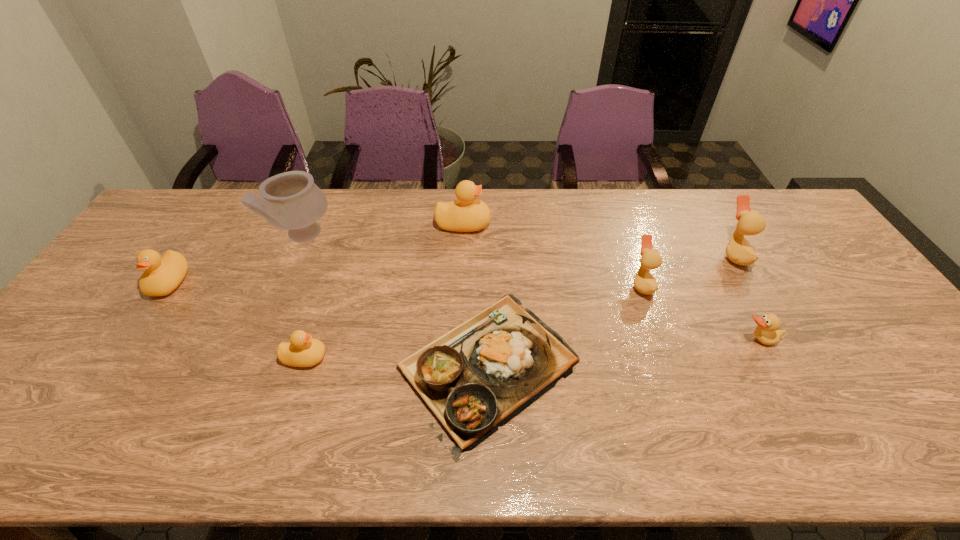
Find the location of `blank region between the platter and the rightmost yellow duck`. blank region between the platter and the rightmost yellow duck is located at coordinates (474, 295).

Where is `free spot between the shortest object and the rightmost yellow duck`? The height and width of the screenshot is (540, 960). free spot between the shortest object and the rightmost yellow duck is located at coordinates pos(474,295).

Identify which object is the seventh closest to the leftmost tan duck. Please provide its 2D coordinates. Your answer should be formatted as a tuple, i.e. [(x, y)], where the tuple contains the x and y coordinates of a point satisfying the conditions above.

[(162, 275)]

Find the location of a particular element. the second closest object to the sixth object from left to right is located at coordinates (767, 332).

Locate an element on the screen. duck identified as the fifth closest to the smallest yellow duck is located at coordinates pyautogui.click(x=738, y=250).

The height and width of the screenshot is (540, 960). I want to click on duck that is the second closest to the second yellow duck from right to left, so click(465, 214).

Identify which yellow duck is located as the second nearest to the fourth duck from right to left. Please provide its 2D coordinates. Your answer should be formatted as a tuple, i.e. [(x, y)], where the tuple contains the x and y coordinates of a point satisfying the conditions above.

[(162, 275)]

Identify which yellow duck is located as the nearest to the leftmost yellow duck. Please provide its 2D coordinates. Your answer should be formatted as a tuple, i.e. [(x, y)], where the tuple contains the x and y coordinates of a point satisfying the conditions above.

[(302, 351)]

At what (x,y) coordinates should I click in order to perform the action: click on tan duck that is the nearest to the biggest tan duck. Please return your answer as a coordinate pair (x, y). Looking at the image, I should click on 767,332.

Image resolution: width=960 pixels, height=540 pixels. Find the location of `tan duck that stands as the closest to the biggest tan duck`. tan duck that stands as the closest to the biggest tan duck is located at coordinates (767, 332).